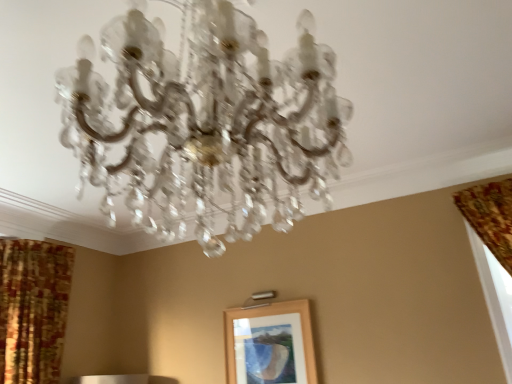
Question: From a real-world perspective, is patterned fabric curtain at left below clear crystal chandelier at center?

Choices:
 (A) yes
 (B) no

Answer: (A)

Question: Could you tell me if patterned fabric curtain at left is turned towards clear crystal chandelier at center?

Choices:
 (A) yes
 (B) no

Answer: (B)

Question: Does patterned fabric curtain at left have a lesser width compared to clear crystal chandelier at center?

Choices:
 (A) no
 (B) yes

Answer: (B)

Question: Would you consider patterned fabric curtain at left to be distant from clear crystal chandelier at center?

Choices:
 (A) no
 (B) yes

Answer: (B)

Question: Can you confirm if patterned fabric curtain at left is wider than clear crystal chandelier at center?

Choices:
 (A) yes
 (B) no

Answer: (B)

Question: Based on their sizes in the image, would you say clear crystal chandelier at center is bigger or smaller than patterned fabric curtain at left?

Choices:
 (A) small
 (B) big

Answer: (A)

Question: Is clear crystal chandelier at center situated inside patterned fabric curtain at left or outside?

Choices:
 (A) outside
 (B) inside

Answer: (A)

Question: Is point (250, 139) positioned closer to the camera than point (8, 284)?

Choices:
 (A) farther
 (B) closer

Answer: (B)

Question: From the image's perspective, is clear crystal chandelier at center above or below patterned fabric curtain at left?

Choices:
 (A) below
 (B) above

Answer: (B)

Question: Which is correct: clear crystal chandelier at center is inside wooden picture frame at center, or outside of it?

Choices:
 (A) outside
 (B) inside

Answer: (A)

Question: Considering the positions of clear crystal chandelier at center and wooden picture frame at center in the image, is clear crystal chandelier at center wider or thinner than wooden picture frame at center?

Choices:
 (A) thin
 (B) wide

Answer: (B)

Question: Does point (143, 54) appear closer or farther from the camera than point (296, 342)?

Choices:
 (A) farther
 (B) closer

Answer: (B)

Question: From a real-world perspective, relative to wooden picture frame at center, is clear crystal chandelier at center vertically above or below?

Choices:
 (A) above
 (B) below

Answer: (A)

Question: Considering their positions, is wooden picture frame at center located in front of or behind clear crystal chandelier at center?

Choices:
 (A) behind
 (B) front

Answer: (A)

Question: From a real-world perspective, is wooden picture frame at center above or below clear crystal chandelier at center?

Choices:
 (A) below
 (B) above

Answer: (A)